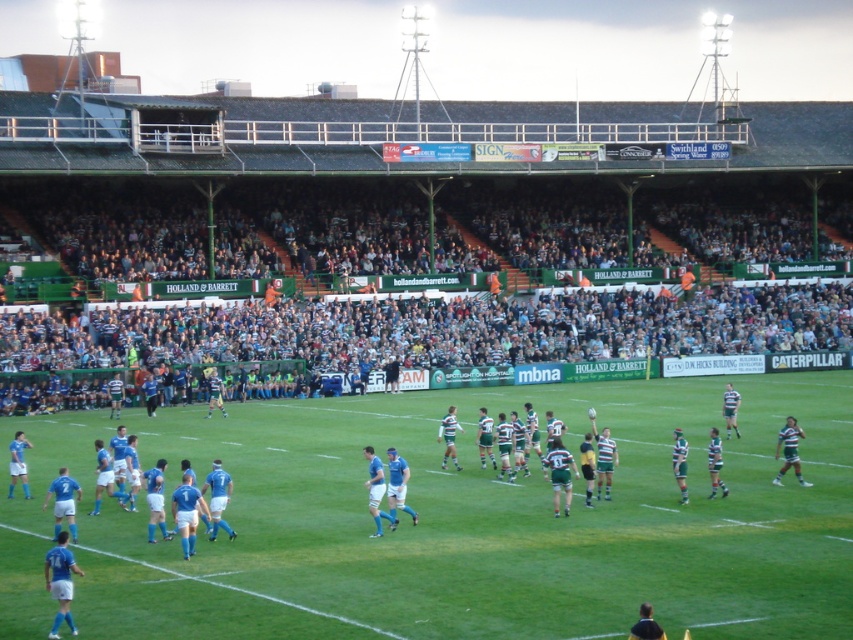
Is green grass field at center bigger than dark gray crowd at upper center?

→ No, green grass field at center is not bigger than dark gray crowd at upper center.

Does green grass field at center have a lesser height compared to dark gray crowd at upper center?

Yes, green grass field at center is shorter than dark gray crowd at upper center.

Between point (815, 492) and point (801, 211), which one is positioned behind?

The point (801, 211) is behind.

You are a GUI agent. You are given a task and a screenshot of the screen. Output one action in this format:
    pyautogui.click(x=<x>, y=<y>)
    Task: Click on the green grass field at center
    
    Given the screenshot: What is the action you would take?
    pyautogui.click(x=490, y=522)